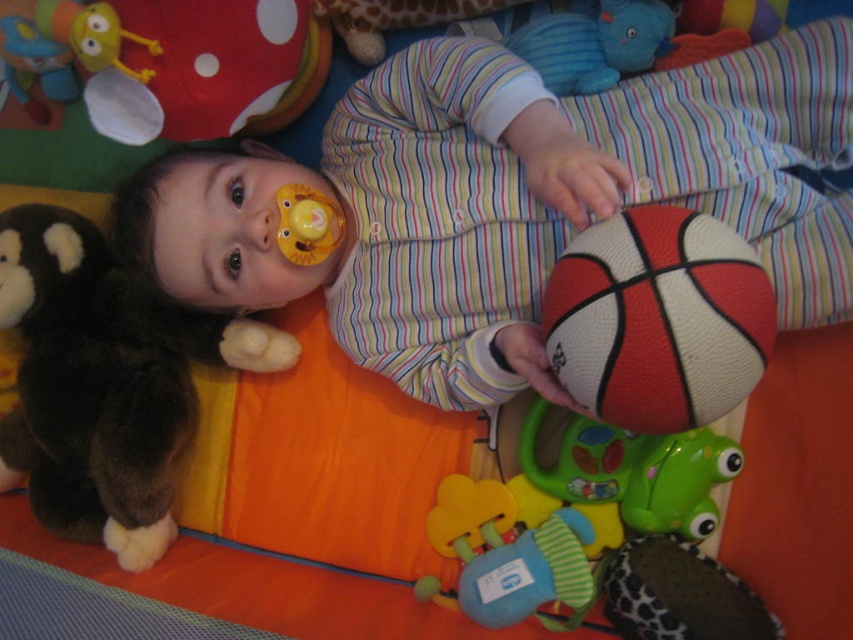
You are a parent trying to reach for the brown plush monkey at left while holding your baby who is the striped fabric baby at center. Can you grab the toy without moving the baby?

The distance between the striped fabric baby at center and the brown plush monkey at left is 11.69 inches, so yes, you can grab the toy without moving the baby as the distance is sufficient.

You are a photographer trying to capture the baby in the center of the image. You need to place a focus point at the exact center of the baby. The focus point coordinates are given as a point between 0 and 1 in both x and y directions. The focus point must be placed on the striped fabric of the baby. Is the provided point at coordinates (502, 200) suitable for this purpose?

Yes, the point at coordinates (502, 200) is suitable because the Objects Description states that it is on the striped fabric baby at center.

You are taking a photo of the baby and need to focus on two specific points in the image. The first point is at coordinate point (815,198) and the second is at point (170,534). Which point should you focus on to ensure the baby is in sharp focus?

You should focus on point (815,198) because it is closer to the camera than point (170,534), so focusing there will keep the baby in sharp focus.